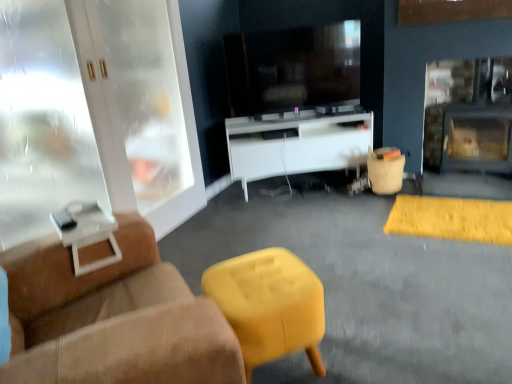
Question: Would you say suede brown studio couch at left is to the left or to the right of white glossy cabinet at center in the picture?

Choices:
 (A) right
 (B) left

Answer: (B)

Question: In terms of width, does suede brown studio couch at left look wider or thinner when compared to white glossy cabinet at center?

Choices:
 (A) thin
 (B) wide

Answer: (B)

Question: Which of these objects is positioned farthest from the matte yellow stool at center, the 2th bar stool viewed from the right?

Choices:
 (A) white glossy cabinet at left
 (B) matte black fireplace at right
 (C) matte black television at center
 (D) suede ottoman at lower center
 (E) white glossy cabinet at center

Answer: (B)

Question: Estimate the real-world distances between objects in this image. Which object is farther from the suede ottoman at lower center?

Choices:
 (A) white glossy cabinet at left
 (B) matte yellow stool at center, which is the second bar stool from back to front
 (C) white glossy cabinet at center
 (D) matte black television at center
 (E) matte black fireplace at right

Answer: (E)